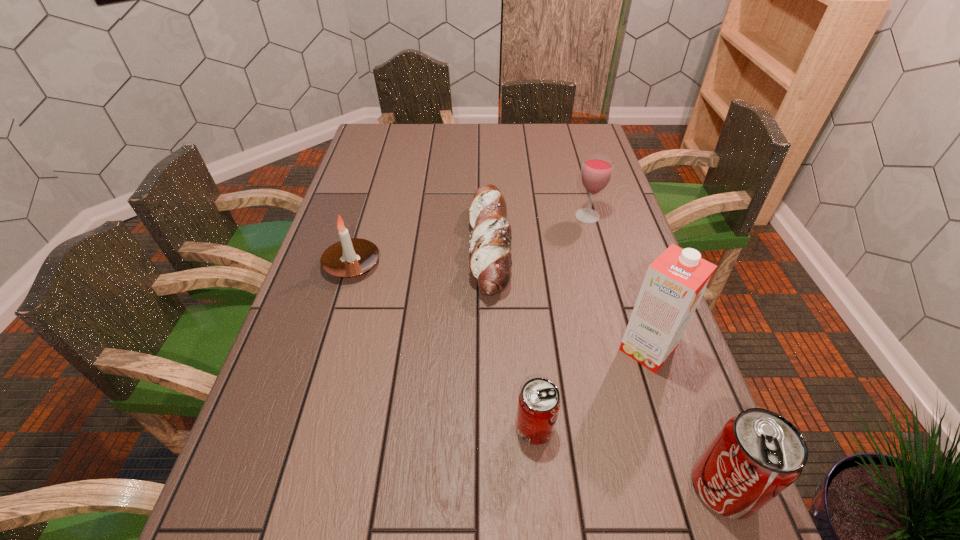
Where is `free point located 0.160m on the left of the taller pop soda`? The height and width of the screenshot is (540, 960). free point located 0.160m on the left of the taller pop soda is located at coordinates (605, 487).

At what (x,y) coordinates should I click in order to perform the action: click on free region located on the front of the wineglass. Please return your answer as a coordinate pair (x, y). Looking at the image, I should click on (595, 245).

Identify the location of vacant space located on the back of the shortest object. This screenshot has height=540, width=960. (488, 150).

Where is `free spot located on the back of the candle`? The width and height of the screenshot is (960, 540). free spot located on the back of the candle is located at coordinates (369, 209).

This screenshot has width=960, height=540. In order to click on vacant space located on the back of the tallest object in this screenshot , I will do `click(635, 312)`.

Identify the location of object present at the near edge. (758, 453).

Where is `object present at the left edge`? The image size is (960, 540). object present at the left edge is located at coordinates (350, 257).

The width and height of the screenshot is (960, 540). Find the location of `pop soda that is at the right edge`. pop soda that is at the right edge is located at coordinates (758, 453).

The image size is (960, 540). Identify the location of wineglass located in the right edge section of the desktop. (596, 171).

This screenshot has height=540, width=960. What are the coordinates of `carton positioned at the right edge` in the screenshot? It's located at (675, 282).